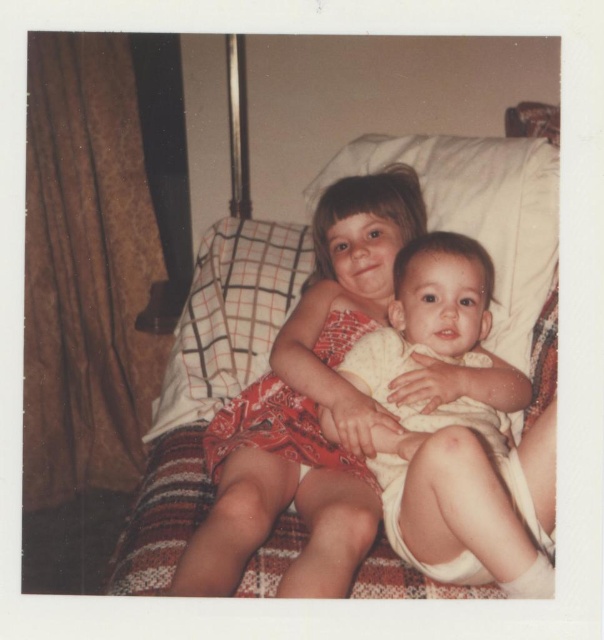
Between point (431, 516) and point (295, 244), which one is positioned in front?

Point (431, 516) is more forward.

Which is above, white cloth diaper at center or white checkered pillow at upper left?

white checkered pillow at upper left is higher up.

Who is more distant from viewer, (x=428, y=339) or (x=184, y=364)?

The point (x=184, y=364) is more distant.

Identify the location of white cloth diaper at center. Image resolution: width=604 pixels, height=640 pixels. coord(448,429).

What do you see at coordinates (309, 406) in the screenshot?
I see `matte red dress at center` at bounding box center [309, 406].

Is matte red dress at center positioned before white cloth diaper at center?

No, matte red dress at center is further to the viewer.

Is point (226, 568) positioned behind point (397, 312)?

That is False.

Find the location of `matte red dress at center`. matte red dress at center is located at coordinates pos(309,406).

Is matte red dress at center below white checkered pillow at upper left?

Yes, matte red dress at center is below white checkered pillow at upper left.

Is point (352, 294) positioned after point (237, 252)?

That is False.

You are a GUI agent. You are given a task and a screenshot of the screen. Output one action in this format:
    pyautogui.click(x=<x>, y=<y>)
    Task: Click on the matte red dress at center
    This screenshot has width=604, height=640.
    Given the screenshot: What is the action you would take?
    pyautogui.click(x=309, y=406)

Locate an element on the screen. matte red dress at center is located at coordinates (309, 406).